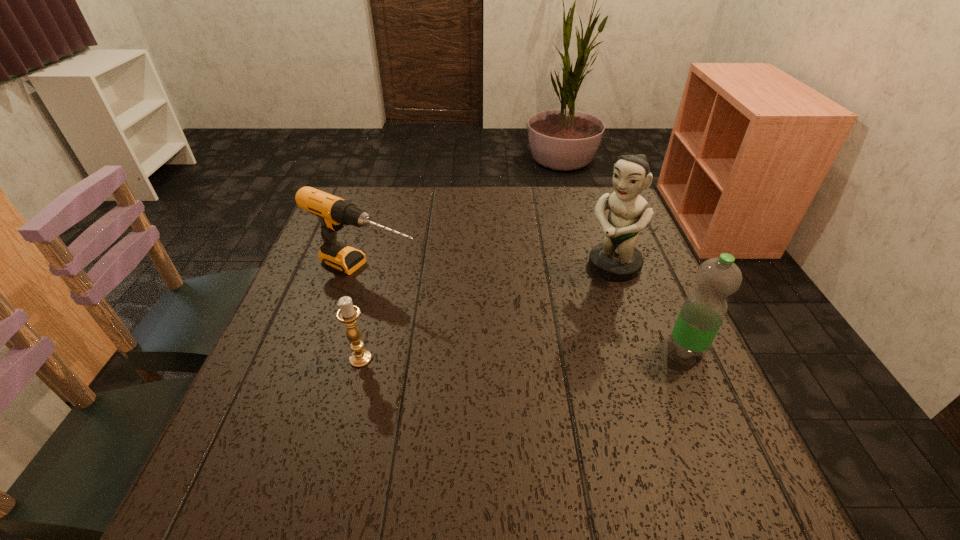
You are a GUI agent. You are given a task and a screenshot of the screen. Output one action in this format:
    pyautogui.click(x=<x>, y=<y>)
    Task: Click on the free spot on the desktop that is between the candle holder and the water bottle and is positioned on the handle side of the drill
    
    Given the screenshot: What is the action you would take?
    pyautogui.click(x=548, y=352)

Locate an element on the screen. vacant space on the desktop that is between the candle holder and the second tallest object and is positioned on the front-facing side of the figurine is located at coordinates (506, 354).